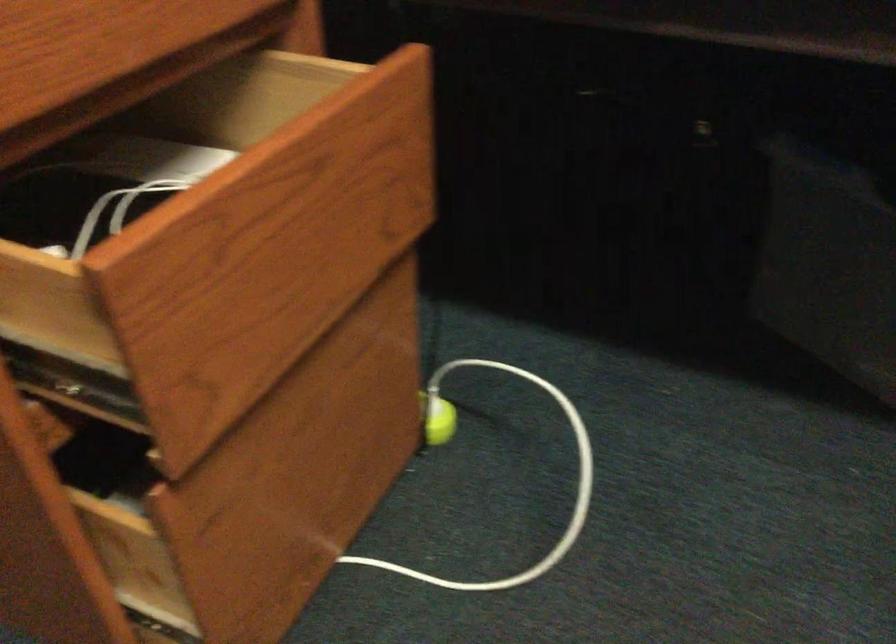
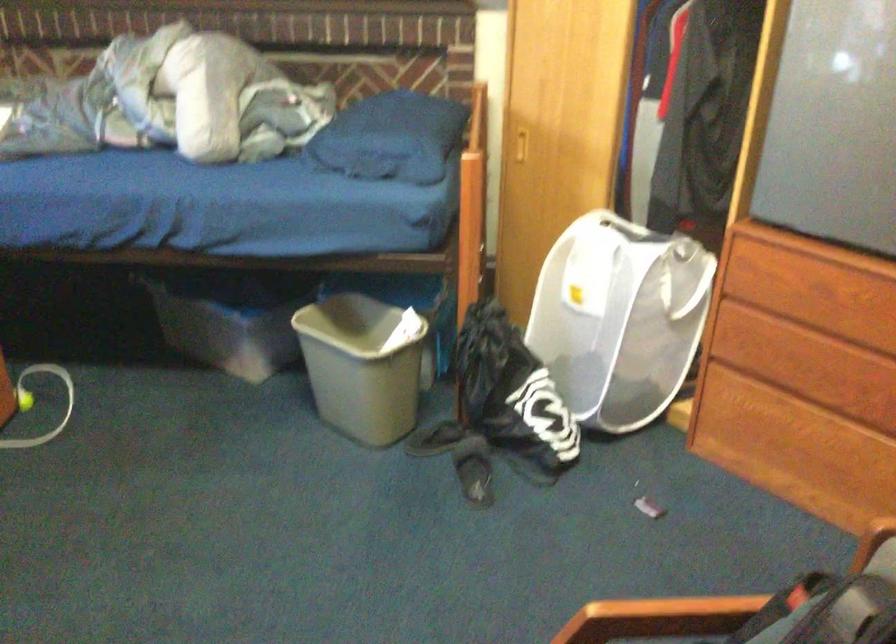
Question: In a continuous first-person perspective shot, in which direction is the camera moving?

Choices:
 (A) Left
 (B) Right
 (C) Forward
 (D) Backward

Answer: (D)